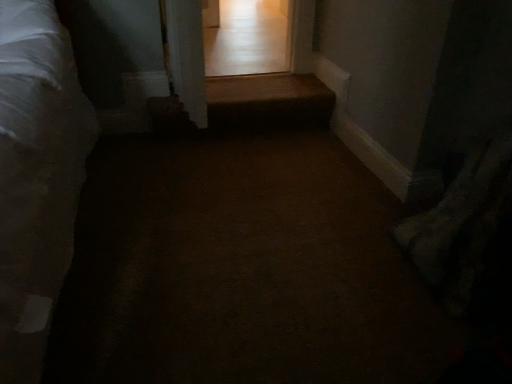
Question: Should I look upward or downward to see brown carpet at center?

Choices:
 (A) up
 (B) down

Answer: (B)